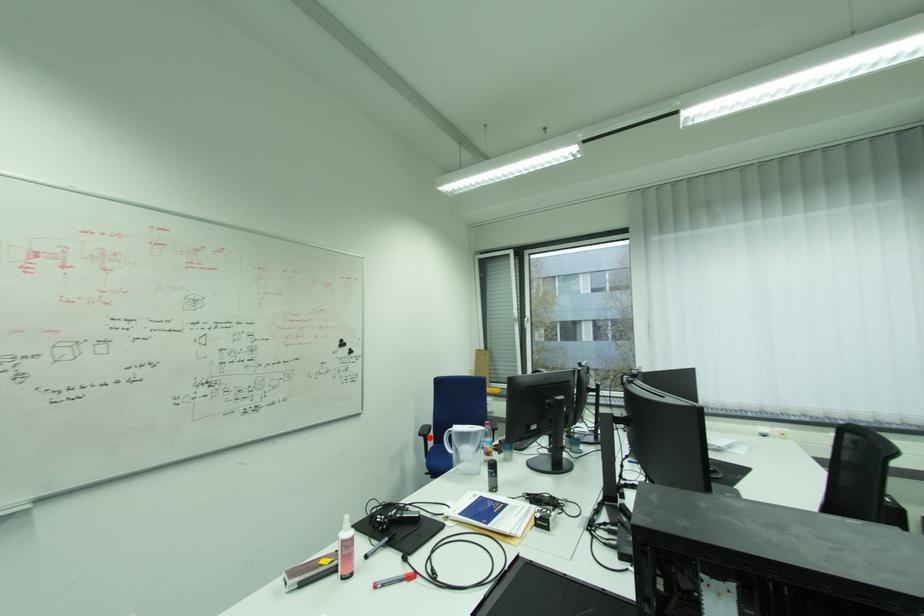
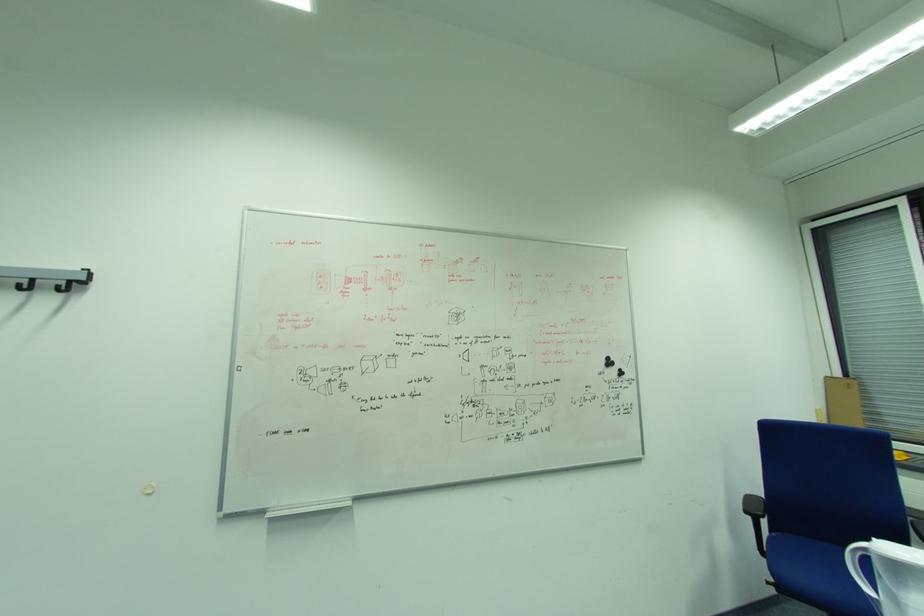
Question: I am providing you with two images of the same scene from different viewpoints. Image1 has a red point marked. In image2, the corresponding 3D location appears at what relative position? Reply with the corresponding letter.

Choices:
 (A) Closer
 (B) Farther

Answer: (A)